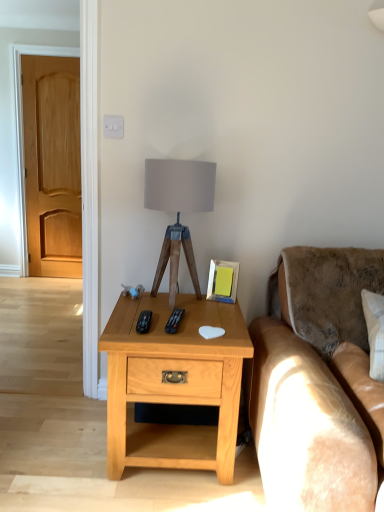
You are a GUI agent. You are given a task and a screenshot of the screen. Output one action in this format:
    pyautogui.click(x=<x>, y=<y>)
    Task: Click on the vacant area that is in front of light brown wood door at left
    This screenshot has width=384, height=512.
    Given the screenshot: What is the action you would take?
    pyautogui.click(x=51, y=284)